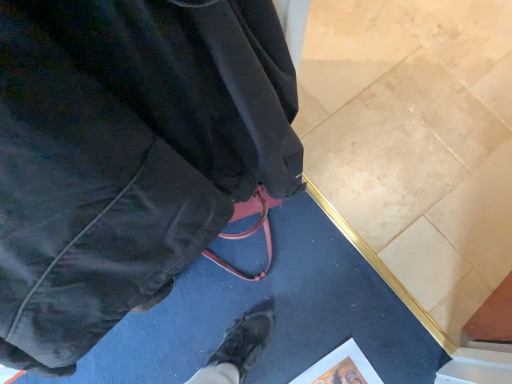
The height and width of the screenshot is (384, 512). Describe the element at coordinates (127, 155) in the screenshot. I see `matte black jacket at center` at that location.

The image size is (512, 384). Identify the location of matte black jacket at center. (127, 155).

This screenshot has width=512, height=384. What do you see at coordinates (341, 368) in the screenshot?
I see `orange matte paper at lower center` at bounding box center [341, 368].

Locate an element on the screen. orange matte paper at lower center is located at coordinates (341, 368).

The height and width of the screenshot is (384, 512). In order to click on matte black jacket at center in this screenshot , I will do `click(127, 155)`.

Based on the photo, which is more to the right, matte black jacket at center or orange matte paper at lower center?

From the viewer's perspective, orange matte paper at lower center appears more on the right side.

Which object is closer to the camera, matte black jacket at center or orange matte paper at lower center?

matte black jacket at center is in front.

Is point (183, 48) positioned before point (344, 352)?

Yes, point (183, 48) is in front of point (344, 352).

From the image's perspective, which one is positioned lower, matte black jacket at center or orange matte paper at lower center?

orange matte paper at lower center.

From a real-world perspective, which is physically above, matte black jacket at center or orange matte paper at lower center?

matte black jacket at center.

Is matte black jacket at center wider or thinner than orange matte paper at lower center?

matte black jacket at center is thinner than orange matte paper at lower center.

Who is taller, matte black jacket at center or orange matte paper at lower center?

Standing taller between the two is matte black jacket at center.

Is matte black jacket at center bigger than orange matte paper at lower center?

Yes.

Can orange matte paper at lower center be found inside matte black jacket at center?

No.

Are matte black jacket at center and orange matte paper at lower center located far from each other?

Actually, matte black jacket at center and orange matte paper at lower center are a little close together.

Is matte black jacket at center positioned with its back to orange matte paper at lower center?

No, matte black jacket at center is not facing away from orange matte paper at lower center.

How many degrees apart are the facing directions of matte black jacket at center and orange matte paper at lower center?

The angular difference between matte black jacket at center and orange matte paper at lower center is 84.8 degrees.

Find the location of a particular element. The width and height of the screenshot is (512, 384). jacket that is in front of the orange matte paper at lower center is located at coordinates (127, 155).

Which object is positioned more to the left, orange matte paper at lower center or matte black jacket at center?

Positioned to the left is matte black jacket at center.

Which is in front, orange matte paper at lower center or matte black jacket at center?

matte black jacket at center is closer to the camera.

Does point (365, 383) come farther from viewer compared to point (175, 37)?

Yes.

From the image's perspective, is orange matte paper at lower center on top of matte black jacket at center?

No, from the image's perspective, orange matte paper at lower center is not over matte black jacket at center.

From a real-world perspective, is orange matte paper at lower center physically above matte black jacket at center?

No.

Consider the image. Can you confirm if orange matte paper at lower center is thinner than matte black jacket at center?

In fact, orange matte paper at lower center might be wider than matte black jacket at center.

Considering the sizes of objects orange matte paper at lower center and matte black jacket at center in the image provided, who is taller, orange matte paper at lower center or matte black jacket at center?

Standing taller between the two is matte black jacket at center.

Considering the relative sizes of orange matte paper at lower center and matte black jacket at center in the image provided, is orange matte paper at lower center bigger than matte black jacket at center?

No.

Is orange matte paper at lower center inside the boundaries of matte black jacket at center, or outside?

orange matte paper at lower center exists outside the volume of matte black jacket at center.

Is the surface of orange matte paper at lower center in direct contact with matte black jacket at center?

No.

Does orange matte paper at lower center turn towards matte black jacket at center?

No, orange matte paper at lower center does not turn towards matte black jacket at center.

You are a GUI agent. You are given a task and a screenshot of the screen. Output one action in this format:
    pyautogui.click(x=<x>, y=<y>)
    Task: Click on the paperback book located underneath the matte black jacket at center (from a real-world perspective)
    The image size is (512, 384).
    Given the screenshot: What is the action you would take?
    pyautogui.click(x=341, y=368)

The width and height of the screenshot is (512, 384). I want to click on jacket in front of the orange matte paper at lower center, so click(127, 155).

Image resolution: width=512 pixels, height=384 pixels. In order to click on jacket above the orange matte paper at lower center (from a real-world perspective) in this screenshot , I will do `click(127, 155)`.